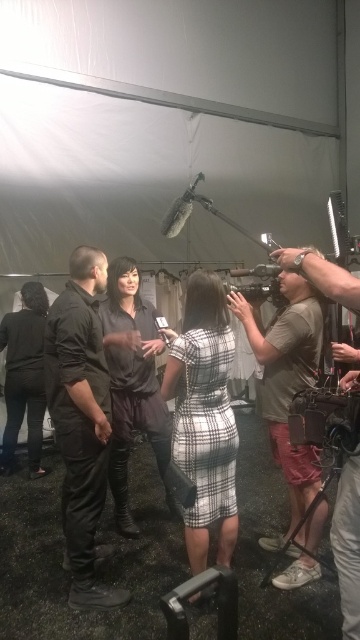
Who is taller, khaki cotton shirt at right or black plastic video camera at center?

khaki cotton shirt at right

Does point (272, 442) come behind point (276, 280)?

That is True.

This screenshot has height=640, width=360. What are the coordinates of `khaki cotton shirt at right` in the screenshot? It's located at (286, 384).

Does dark brown leather boots at center lie in front of black plastic video camera at center?

No, it is behind black plastic video camera at center.

Who is taller, dark brown leather boots at center or black plastic video camera at center?

dark brown leather boots at center

Measure the distance between dark brown leather boots at center and camera.

dark brown leather boots at center is 8.89 feet away from camera.

Where is `dark brown leather boots at center`? This screenshot has height=640, width=360. dark brown leather boots at center is located at coordinates (132, 384).

Which is in front, point (318, 273) or point (250, 282)?

Point (318, 273) is in front.

Does point (340, 534) come behind point (271, 280)?

No, (340, 534) is in front of (271, 280).

The width and height of the screenshot is (360, 640). In order to click on matte gray shirt at right in this screenshot , I will do `click(348, 545)`.